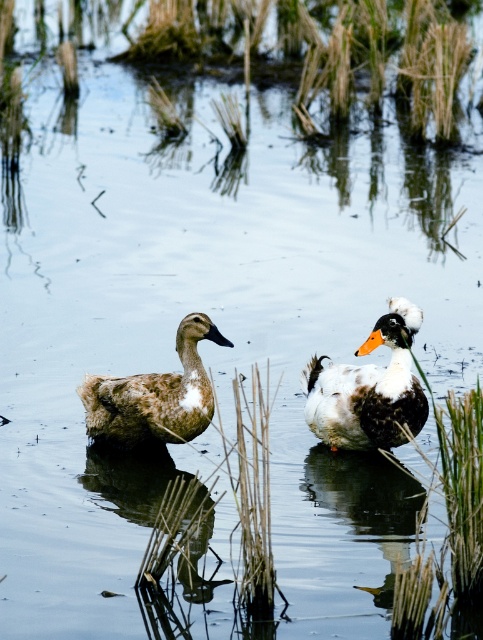
You are standing at a point 40 feet away from the image. If you walk towards the point labeled point (332, 54), will you reach it before you walk 45 feet?

The point labeled point (332, 54) is 41.92 feet away from the viewer. Since you are starting 40 feet away and need to walk an additional 1.92 feet to reach it, you will reach the point before walking 45 feet.

You are a photographer aiming to capture a clear shot of the brown fuzzy duck at left and the brown grass at center. Since the duck is partially hidden, which object should you focus on first to ensure both are visible in your photo?

The brown fuzzy duck at left is behind brown grass at center, so you should focus on the brown grass at center first to ensure both are visible.